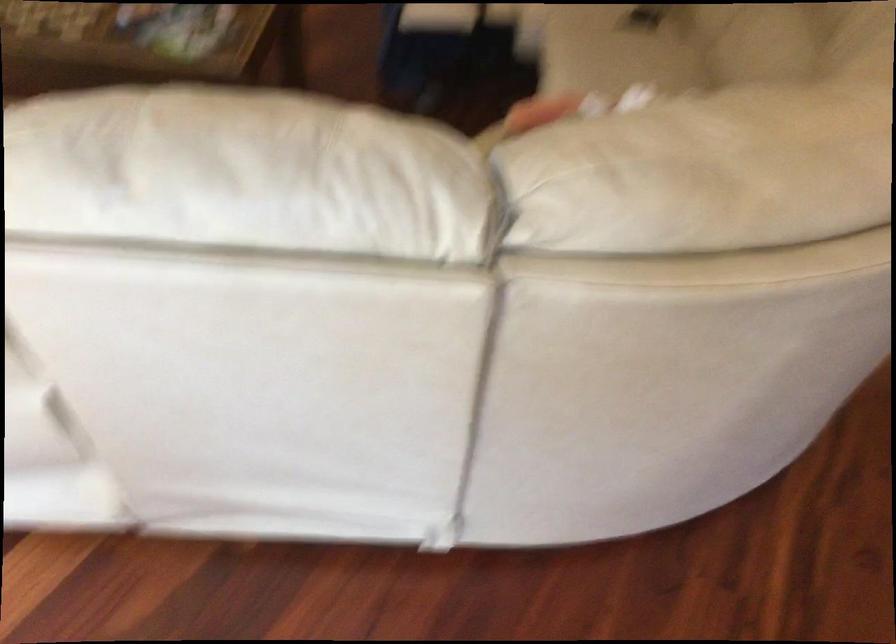
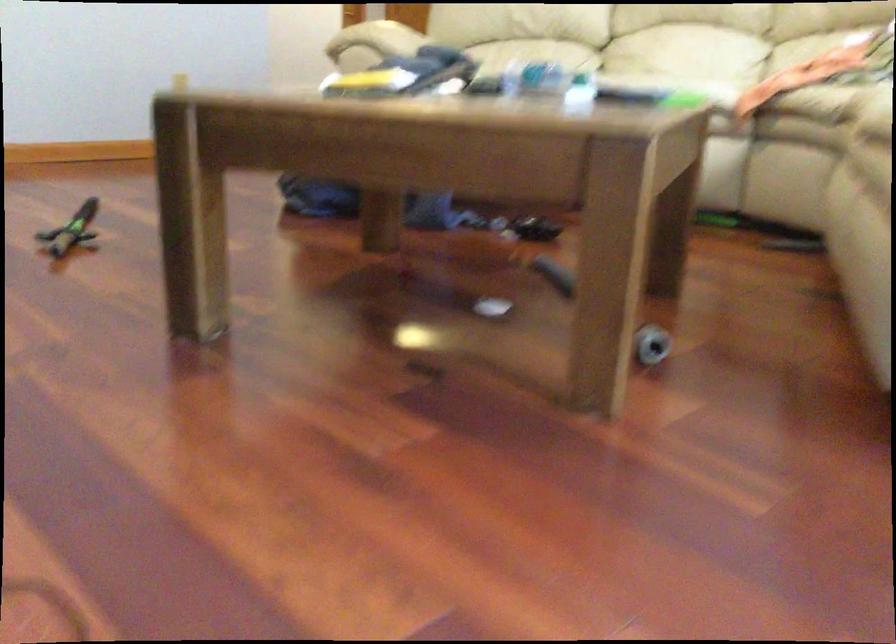
Question: I am providing you with two images of the same scene from different viewpoints. Please identify which objects are invisible in image2.

Choices:
 (A) white sofa sitting surface
 (B) red door tag
 (C) green toy sword
 (D) clear plastic bottle

Answer: (A)